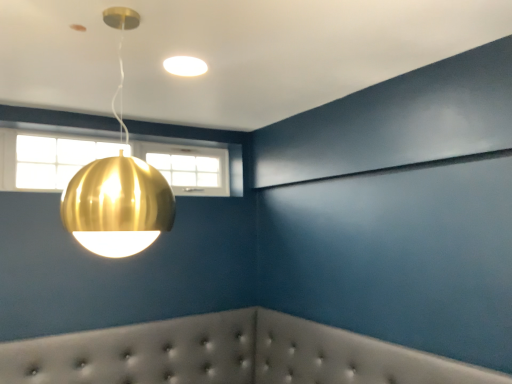
Question: Is gold metallic sphere at upper center, positioned as the 2th lamp in back-to-front order, looking in the opposite direction of matte white light fixture at upper center, which is counted as the 1th lamp, starting from the back?

Choices:
 (A) no
 (B) yes

Answer: (A)

Question: Considering the relative sizes of gold metallic sphere at upper center, positioned as the 2th lamp in back-to-front order, and matte white light fixture at upper center, which is counted as the 1th lamp, starting from the back, in the image provided, is gold metallic sphere at upper center, positioned as the 2th lamp in back-to-front order, taller than matte white light fixture at upper center, which is counted as the 1th lamp, starting from the back,?

Choices:
 (A) no
 (B) yes

Answer: (B)

Question: Does gold metallic sphere at upper center, positioned as the 2th lamp in back-to-front order, lie behind matte white light fixture at upper center, the second lamp from the bottom?

Choices:
 (A) no
 (B) yes

Answer: (A)

Question: Does gold metallic sphere at upper center, the 2th lamp positioned from the top, turn towards matte white light fixture at upper center, which ranks as the second lamp in front-to-back order?

Choices:
 (A) yes
 (B) no

Answer: (B)

Question: Does gold metallic sphere at upper center, the 2th lamp positioned from the top, have a greater width compared to matte white light fixture at upper center, which ranks as the second lamp in front-to-back order?

Choices:
 (A) no
 (B) yes

Answer: (B)

Question: Is gold metallic sphere at upper center, the 2th lamp positioned from the top, far from matte white light fixture at upper center, which ranks as the second lamp in front-to-back order?

Choices:
 (A) yes
 (B) no

Answer: (B)

Question: Does white tufted headboard at lower center have a smaller size compared to clear glass window at upper left?

Choices:
 (A) yes
 (B) no

Answer: (B)

Question: From a real-world perspective, is white tufted headboard at lower center physically below clear glass window at upper left?

Choices:
 (A) yes
 (B) no

Answer: (A)

Question: Is white tufted headboard at lower center facing away from clear glass window at upper left?

Choices:
 (A) yes
 (B) no

Answer: (B)

Question: Is white tufted headboard at lower center at the left side of clear glass window at upper left?

Choices:
 (A) no
 (B) yes

Answer: (A)

Question: Is white tufted headboard at lower center far from clear glass window at upper left?

Choices:
 (A) yes
 (B) no

Answer: (A)

Question: Does white tufted headboard at lower center contain clear glass window at upper left?

Choices:
 (A) no
 (B) yes

Answer: (A)

Question: Does matte white light fixture at upper center, which is counted as the 1th lamp, starting from the back, have a larger size compared to clear glass window at upper left?

Choices:
 (A) no
 (B) yes

Answer: (A)